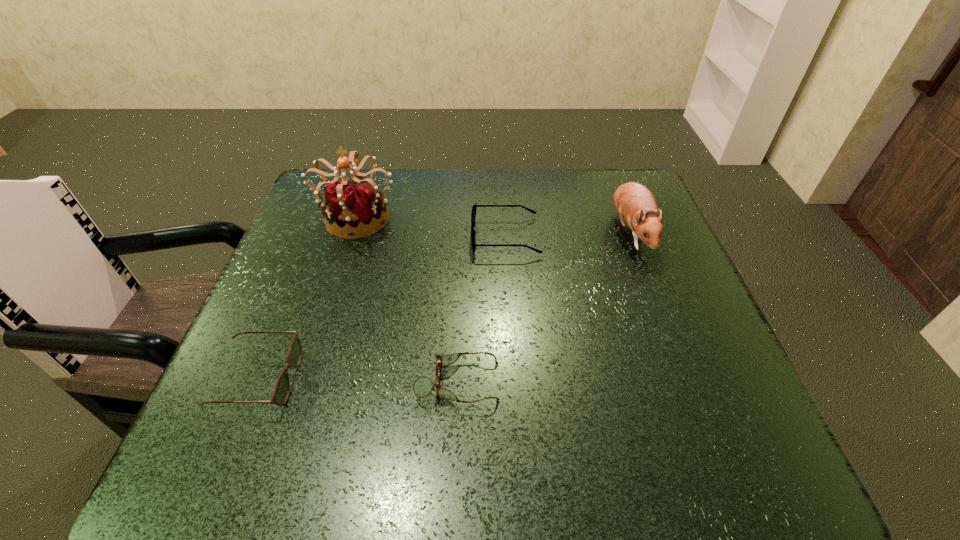
The image size is (960, 540). I want to click on the second closest spectacles to the farthest spectacles, so tap(280, 393).

Locate an element on the screen. spectacles that is the second closest one to the leftmost spectacles is located at coordinates (473, 215).

Locate an element on the screen. Image resolution: width=960 pixels, height=540 pixels. vacant space that satisfies the following two spatial constraints: 1. on the front-facing side of the tiara; 2. at the front view of the leftmost spectacles is located at coordinates (305, 379).

The image size is (960, 540). I want to click on free point that satisfies the following two spatial constraints: 1. at the face of the rightmost object; 2. on the front-facing side of the farthest spectacles, so click(632, 237).

Locate an element on the screen. The width and height of the screenshot is (960, 540). vacant position in the image that satisfies the following two spatial constraints: 1. at the face of the hamster; 2. on the front-facing side of the shortest object is located at coordinates (x=687, y=382).

This screenshot has height=540, width=960. I want to click on vacant space that satisfies the following two spatial constraints: 1. at the face of the second tallest object; 2. on the front-facing side of the farthest spectacles, so click(632, 237).